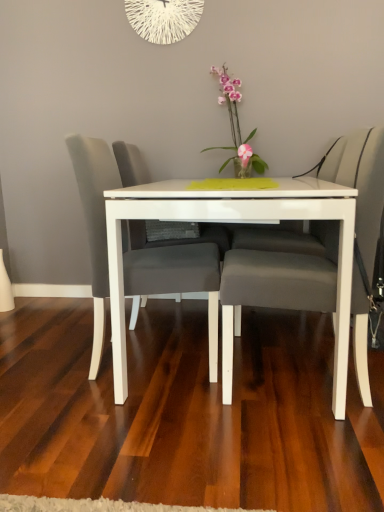
Question: From a real-world perspective, is matte gray swivel chair at center above or below matte gray chair at center, the first chair positioned from the left?

Choices:
 (A) below
 (B) above

Answer: (B)

Question: Which is correct: matte gray swivel chair at center is inside matte gray chair at center, arranged as the 2th chair when viewed from the right, or outside of it?

Choices:
 (A) outside
 (B) inside

Answer: (A)

Question: Which object is the farthest from the matte gray swivel chair at center?

Choices:
 (A) matte gray cushioned chair at center, the 1th chair from the right
 (B) white glossy table at center
 (C) matte gray chair at center, arranged as the 2th chair when viewed from the right
 (D) pink glossy orchid at center
 (E) white string clock at upper center

Answer: (E)

Question: Which is nearer to the matte gray swivel chair at center?

Choices:
 (A) matte gray cushioned chair at center, the 1th chair from the right
 (B) white string clock at upper center
 (C) white glossy table at center
 (D) matte gray chair at center, arranged as the 2th chair when viewed from the right
 (E) pink glossy orchid at center

Answer: (D)